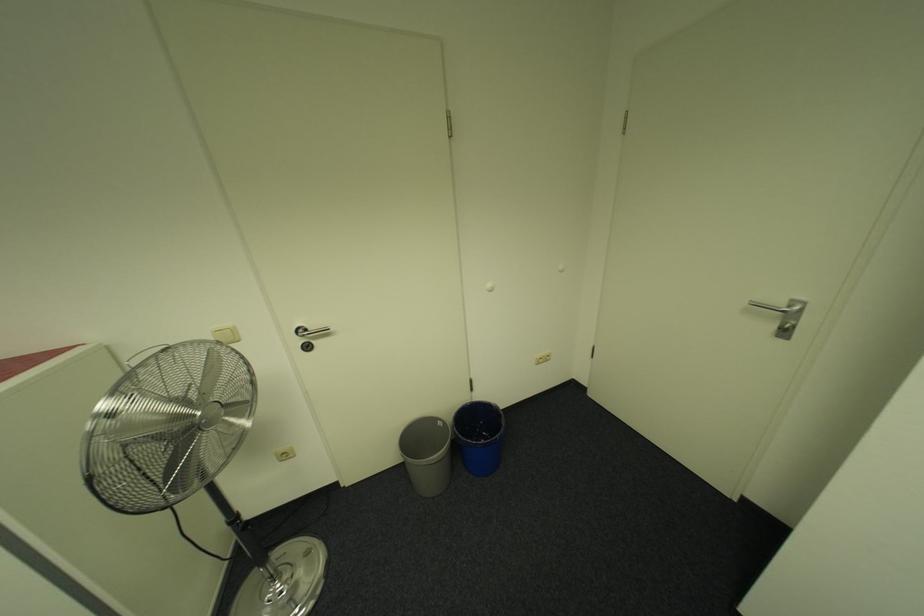
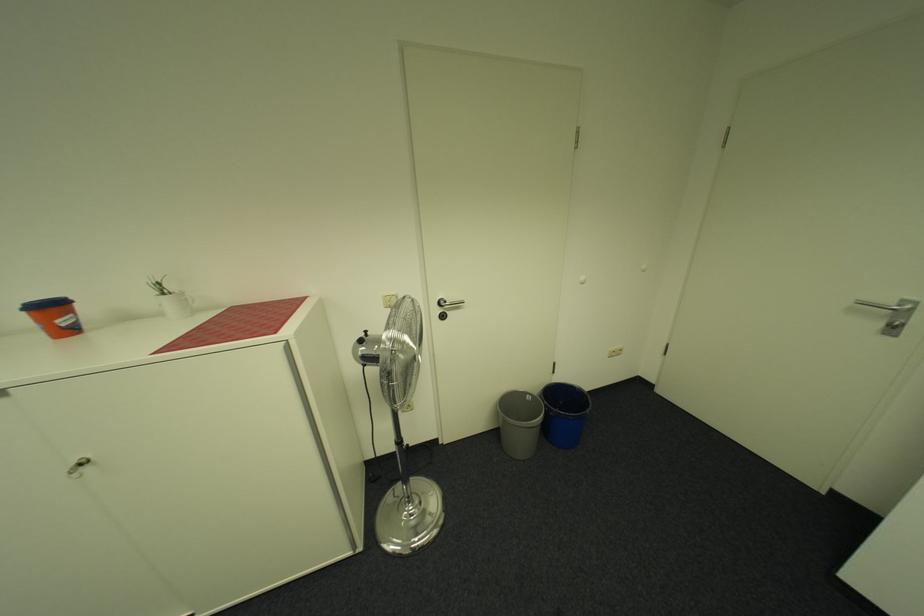
Where in the second image is the point corresponding to (468,437) from the first image?

(562, 408)